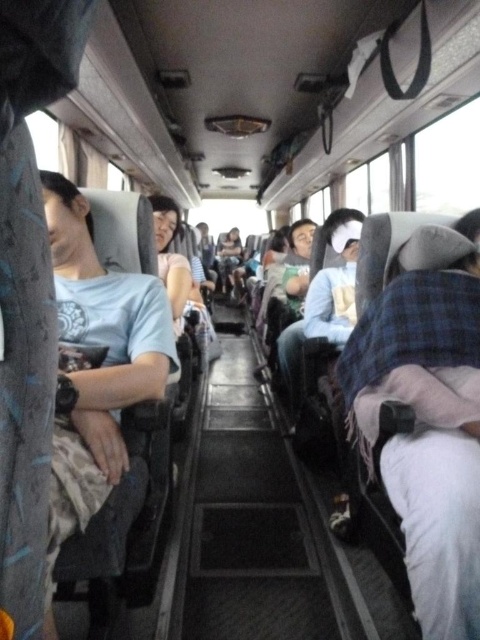
Question: Is matte gray shirt at left wider than light blue fabric pillow at center?

Choices:
 (A) yes
 (B) no

Answer: (B)

Question: Can you confirm if matte gray shirt at left is positioned below light blue fabric pillow at center?

Choices:
 (A) yes
 (B) no

Answer: (A)

Question: Is matte gray shirt at left smaller than light blue fabric pillow at center?

Choices:
 (A) no
 (B) yes

Answer: (B)

Question: Among these points, which one is nearest to the camera?

Choices:
 (A) (48, 189)
 (B) (279, 342)

Answer: (A)

Question: Among these objects, which one is farthest from the camera?

Choices:
 (A) matte gray shirt at left
 (B) light blue fabric pillow at center

Answer: (B)